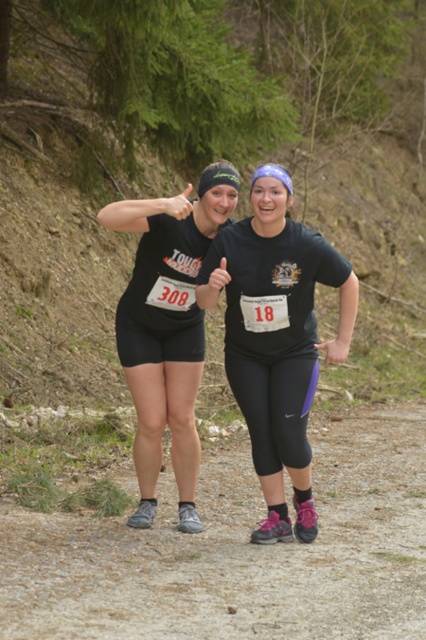
Is point (416, 609) closer to viewer compared to point (147, 518)?

Yes.

This screenshot has width=426, height=640. What do you see at coordinates (238, 552) in the screenshot?
I see `dirt track at center` at bounding box center [238, 552].

Where is `dirt track at center`? This screenshot has height=640, width=426. dirt track at center is located at coordinates (238, 552).